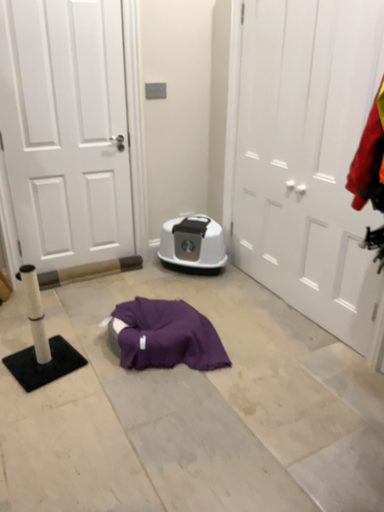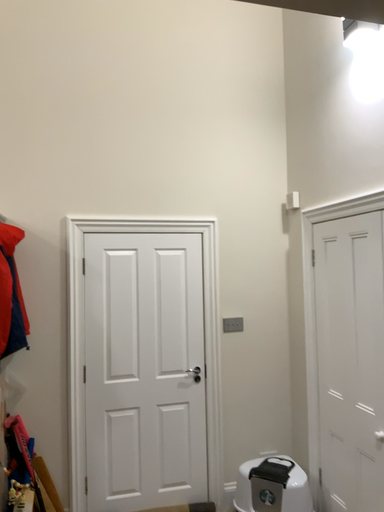
Question: Which way did the camera rotate in the video?

Choices:
 (A) rotated right
 (B) rotated left

Answer: (B)